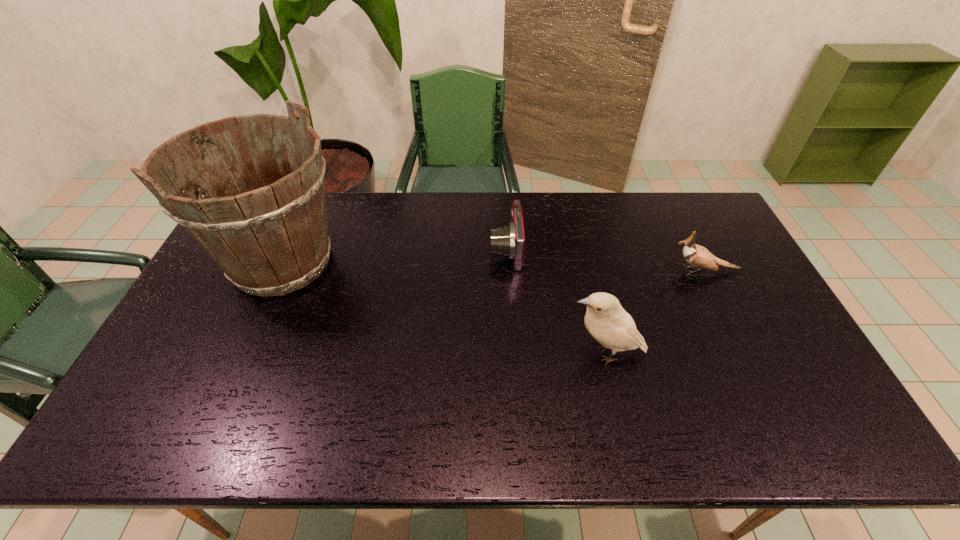
Identify the location of vacant space located at the beak of the left bird. This screenshot has width=960, height=540. (516, 354).

Identify the location of vacant space situated at the beak of the left bird. (527, 354).

At what (x,y) coordinates should I click in order to perform the action: click on vacant region located 0.240m at the face of the right bird. Please return your answer as a coordinate pair (x, y). This screenshot has height=540, width=960. Looking at the image, I should click on (590, 271).

Identify the location of blank space located at the face of the right bird. The image size is (960, 540). (648, 271).

You are a GUI agent. You are given a task and a screenshot of the screen. Output one action in this format:
    pyautogui.click(x=<x>, y=<y>)
    Task: Click on the vacant space located 0.330m at the face of the right bird
    The height and width of the screenshot is (540, 960).
    Given the screenshot: What is the action you would take?
    pyautogui.click(x=562, y=271)

The width and height of the screenshot is (960, 540). What are the coordinates of `vacant region located on the front-facing side of the shortest object` in the screenshot? It's located at (460, 249).

Locate an element on the screen. The height and width of the screenshot is (540, 960). vacant region located 0.320m on the front-facing side of the shortest object is located at coordinates (393, 249).

The image size is (960, 540). Identify the location of vacant space located 0.200m on the front-facing side of the shortest object. (429, 249).

Locate an element on the screen. bucket that is at the far edge is located at coordinates (270, 238).

Image resolution: width=960 pixels, height=540 pixels. I want to click on camera located in the far edge section of the desktop, so click(x=509, y=241).